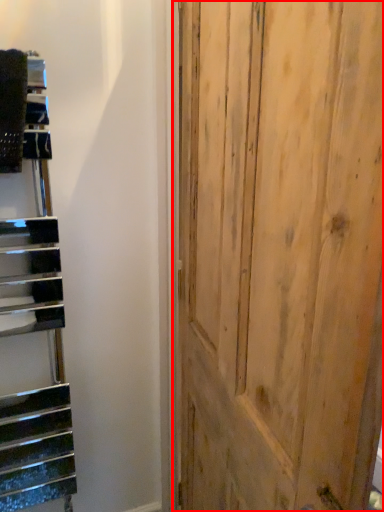
Question: From the image's perspective, what is the correct spatial relationship of door (annotated by the red box) in relation to stairwell?

Choices:
 (A) above
 (B) below

Answer: (B)